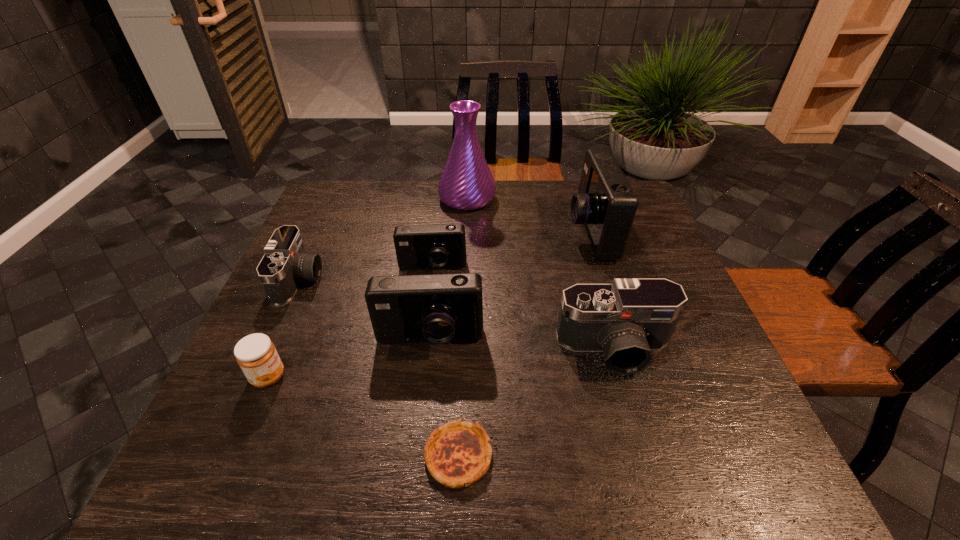
Identify the location of vacant space at the near edge of the desktop. (576, 451).

The height and width of the screenshot is (540, 960). I want to click on vacant space at the left edge of the desktop, so click(x=301, y=296).

Find the location of a particular element. vacant region at the right edge is located at coordinates (665, 353).

The width and height of the screenshot is (960, 540). I want to click on free space at the far left corner of the desktop, so click(372, 188).

You are a GUI agent. You are given a task and a screenshot of the screen. Output one action in this format:
    pyautogui.click(x=<x>, y=<y>)
    Task: Click on the vacant area at the near right corner of the desktop
    This screenshot has width=960, height=540.
    Given the screenshot: What is the action you would take?
    pyautogui.click(x=782, y=482)

Where is `unoccupied area between the smaller black camera and the shortest object`? The width and height of the screenshot is (960, 540). unoccupied area between the smaller black camera and the shortest object is located at coordinates (379, 368).

Image resolution: width=960 pixels, height=540 pixels. What are the coordinates of `free space between the quiche and the left black camera` in the screenshot? It's located at (379, 368).

Where is `vacant region between the orange jam and the farther black camera`? The image size is (960, 540). vacant region between the orange jam and the farther black camera is located at coordinates (284, 329).

The image size is (960, 540). In order to click on free space between the farther black camera and the smallest blue camera in this screenshot , I will do `click(366, 274)`.

Where is `vacant area that lies between the bigger black camera and the smallest blue camera`? vacant area that lies between the bigger black camera and the smallest blue camera is located at coordinates (523, 309).